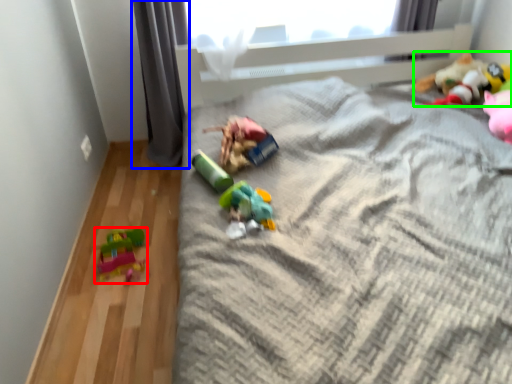
Question: Estimate the real-world distances between objects in this image. Which object is closer to toy (highlighted by a red box), curtain (highlighted by a blue box) or toy (highlighted by a green box)?

Choices:
 (A) curtain
 (B) toy

Answer: (A)